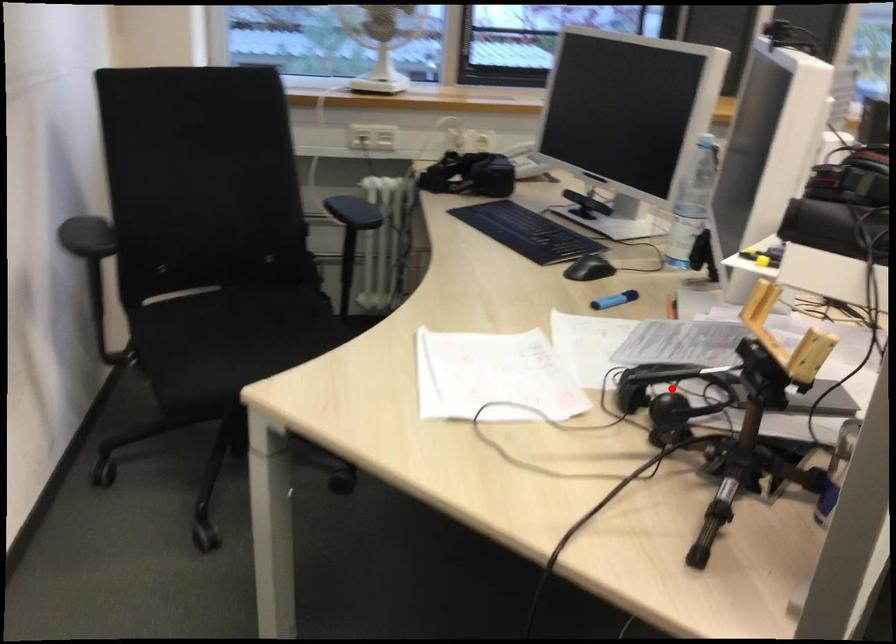
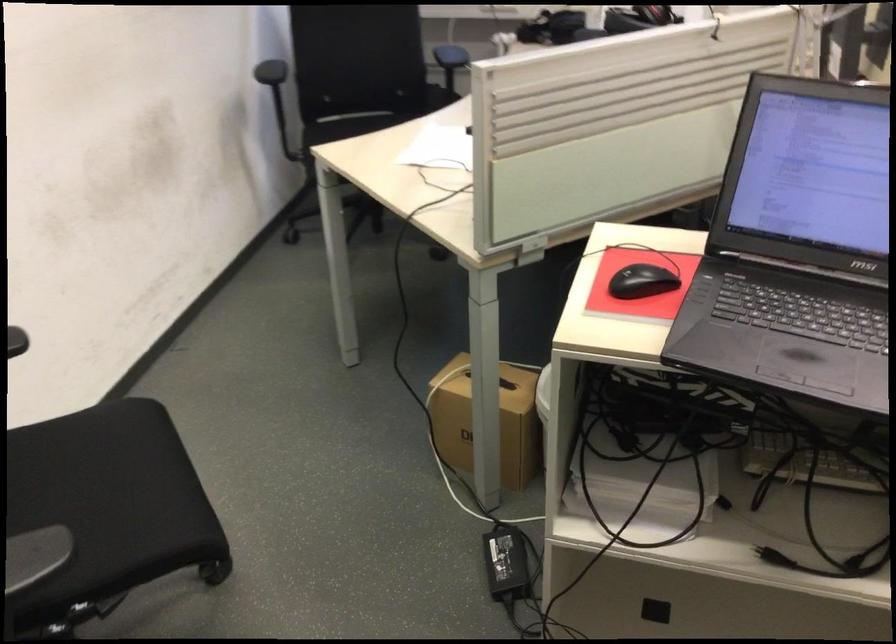
Question: I am providing you with two images of the same scene from different viewpoints. A red point is marked on the first image. At the location where the point appears in image 1, is it still visible in image 2?

Choices:
 (A) Yes
 (B) No

Answer: (B)